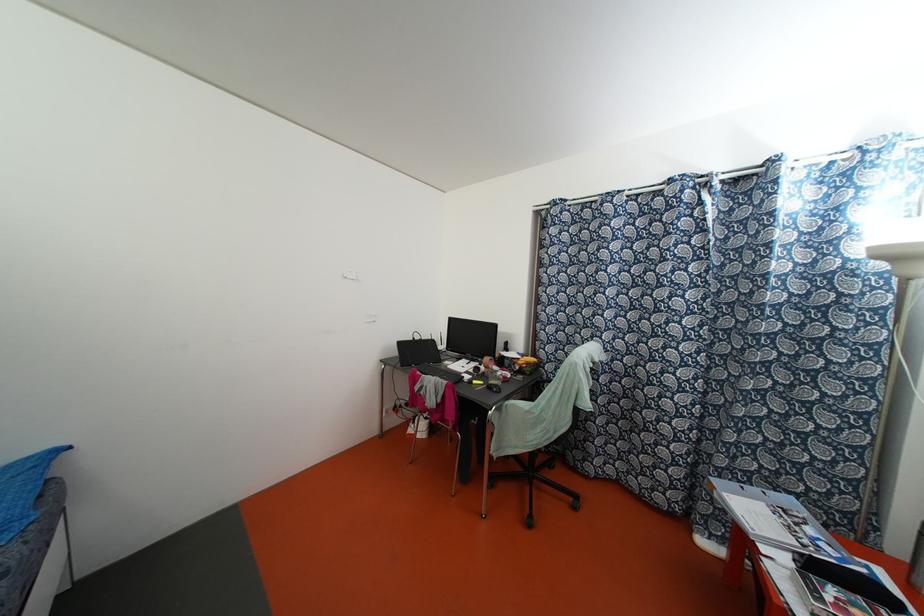
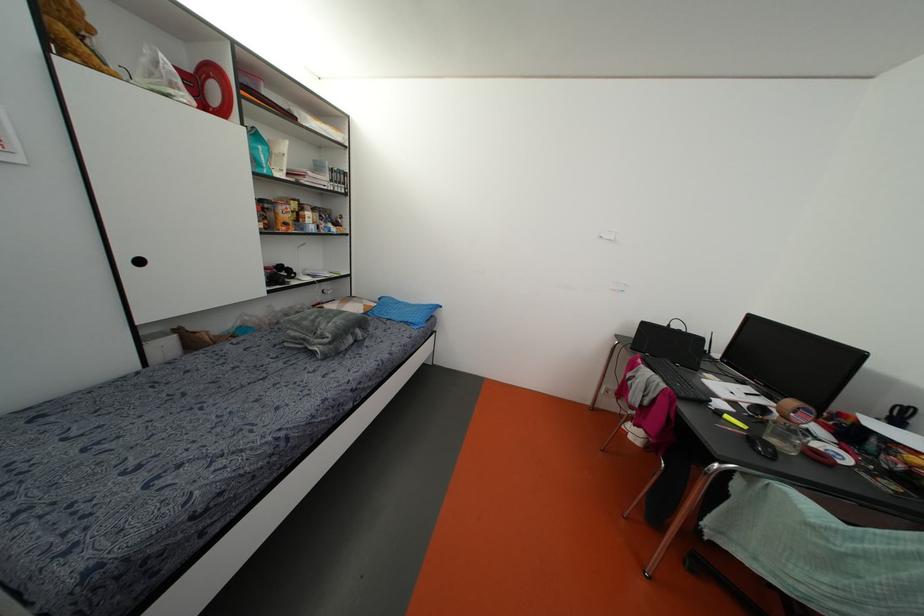
Question: The camera is either moving clockwise (left) or counter-clockwise (right) around the object. The first image is from the beginning of the video and the second image is from the end. Is the camera moving left or right when shooting the video?

Choices:
 (A) Left
 (B) Right

Answer: (B)